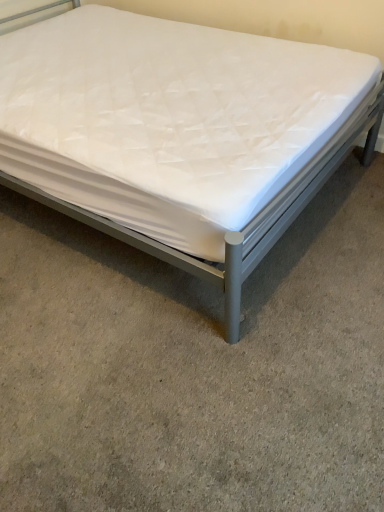
Question: Considering the positions of point (67, 271) and point (288, 84), is point (67, 271) closer or farther from the camera than point (288, 84)?

Choices:
 (A) closer
 (B) farther

Answer: (A)

Question: Is white quilted mattress at center in front of or behind white quilted mattress at center in the image?

Choices:
 (A) front
 (B) behind

Answer: (A)

Question: In terms of width, does white quilted mattress at center look wider or thinner when compared to white quilted mattress at center?

Choices:
 (A) thin
 (B) wide

Answer: (B)

Question: Is point (198, 225) closer or farther from the camera than point (382, 163)?

Choices:
 (A) farther
 (B) closer

Answer: (B)

Question: Choose the correct answer: Is white quilted mattress at center inside white quilted mattress at center or outside it?

Choices:
 (A) outside
 (B) inside

Answer: (A)

Question: Looking at the image, does white quilted mattress at center seem bigger or smaller compared to white quilted mattress at center?

Choices:
 (A) big
 (B) small

Answer: (A)

Question: From the image's perspective, is white quilted mattress at center above or below white quilted mattress at center?

Choices:
 (A) below
 (B) above

Answer: (B)